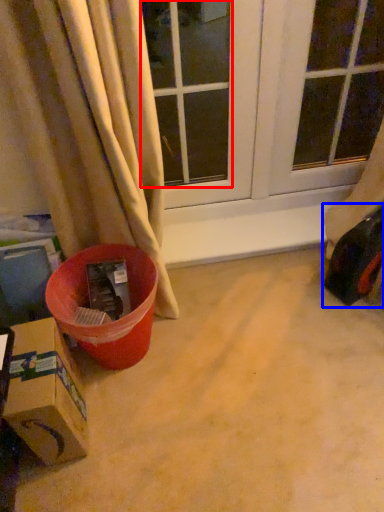
Question: Which of the following is the farthest to the observer, window (highlighted by a red box) or toy car (highlighted by a blue box)?

Choices:
 (A) window
 (B) toy car

Answer: (B)